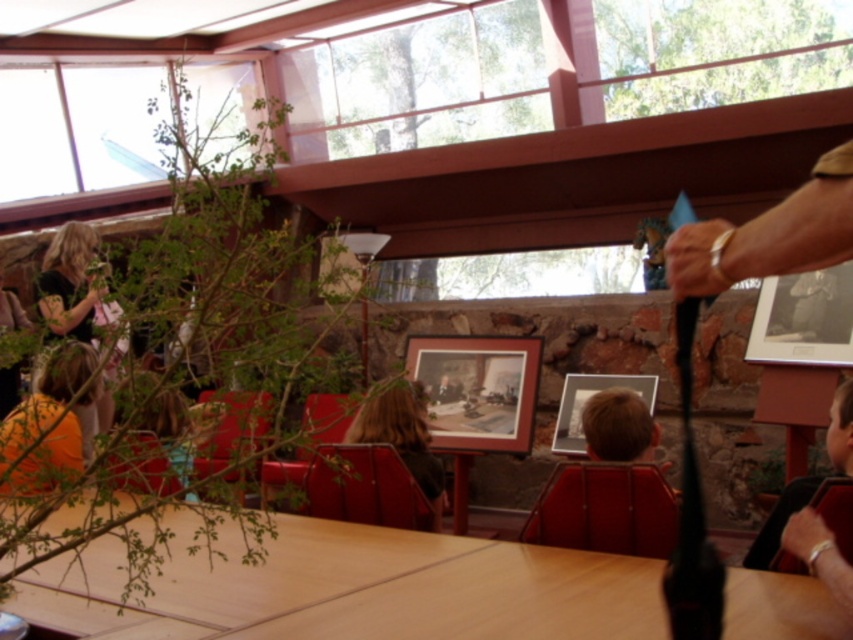
Question: Which object appears closest to the camera in this image?

Choices:
 (A) matte black picture frame at upper right
 (B) blonde hair at center

Answer: (B)

Question: Is light brown wood table at center wider than matte black picture frame at upper right?

Choices:
 (A) yes
 (B) no

Answer: (A)

Question: Considering the real-world distances, which object is farthest from the matte wooden picture frame at center?

Choices:
 (A) light brown hair at lower right
 (B) light brown wood table at center
 (C) blonde hair at center

Answer: (B)

Question: Is orange fabric at left positioned in front of light brown hair at lower right?

Choices:
 (A) yes
 (B) no

Answer: (A)

Question: Is light brown wood table at center above wooden framed picture at center?

Choices:
 (A) yes
 (B) no

Answer: (B)

Question: Which point is closer to the camera?

Choices:
 (A) wooden framed picture at center
 (B) orange fabric at left
 (C) matte black picture frame at upper right

Answer: (B)